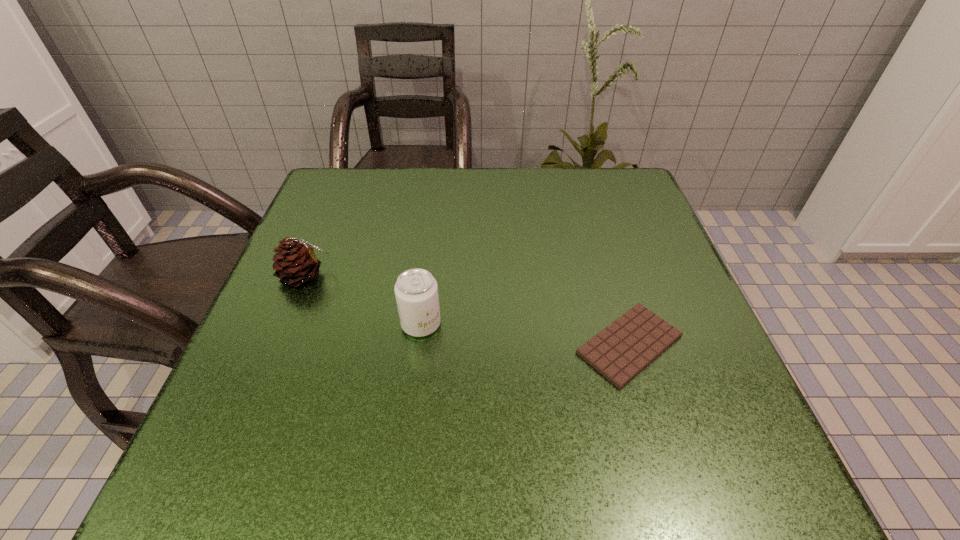
Identify the location of free region that satisfies the following two spatial constraints: 1. with a leaf charm attached to the pinecone; 2. on the left side of the rightmost object. (277, 345).

Find the location of a particular element. This screenshot has width=960, height=540. vacant space that satisfies the following two spatial constraints: 1. with a leaf charm attached to the farthest object; 2. on the right side of the soda can is located at coordinates (285, 324).